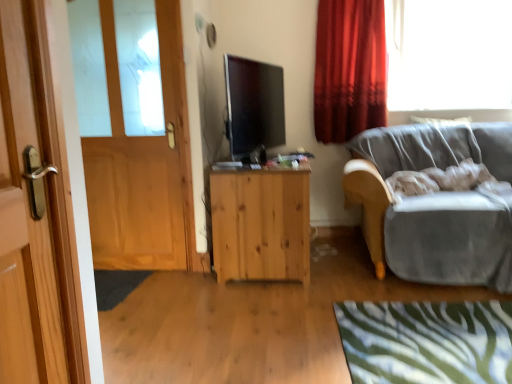
Locate an element on the screen. The image size is (512, 384). vacant area to the left of green zebra-patterned rug at lower right is located at coordinates click(267, 330).